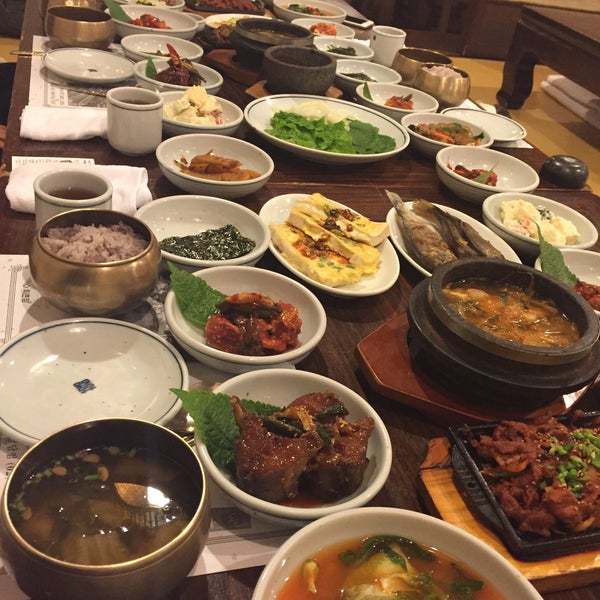
The image size is (600, 600). I want to click on towels, so click(569, 98).